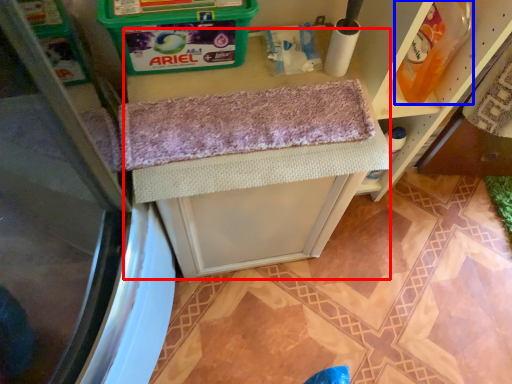
Question: Which of the following is the farthest to the observer, vanity (highlighted by a red box) or cleaning product (highlighted by a blue box)?

Choices:
 (A) vanity
 (B) cleaning product

Answer: (A)